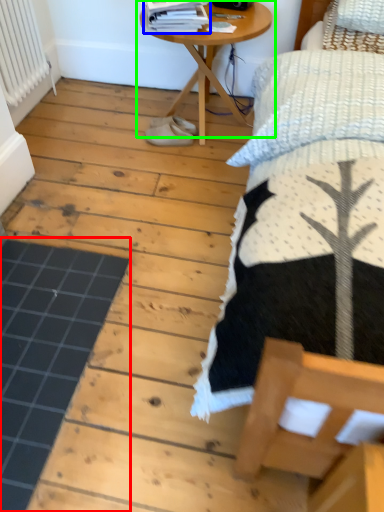
Question: Based on their relative distances, which object is farther from plank (highlighted by a red box)? Choose from magazine (highlighted by a blue box) and table (highlighted by a green box).

Choices:
 (A) magazine
 (B) table

Answer: (A)